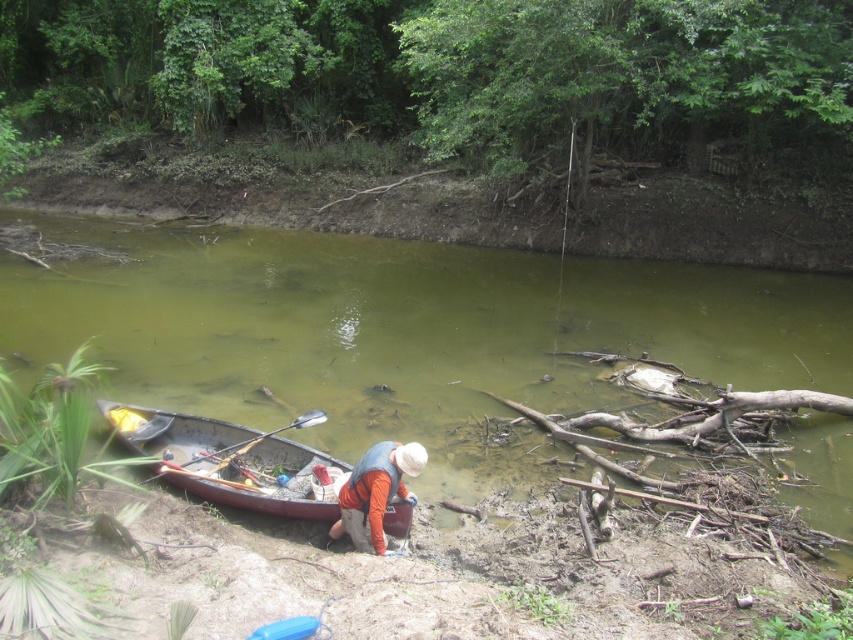
You are standing at the riverbank and see the orange fabric at lower center and the wooden polished paddle at lower center. Which object is taller?

The orange fabric at lower center is much taller than the wooden polished paddle at lower center.

You are standing at the edge of the river and see the green murky water at center and the orange fabric at lower center. Which object is closer to your right side?

The orange fabric at lower center is closer to your right side because the green murky water at center is to the left of it.

You are standing at the riverbank and want to pick up the orange fabric at lower center and the wooden polished paddle at lower center. Which object should you reach for first to grab the one closer to you?

The orange fabric at lower center is closer to the viewer than the wooden polished paddle at lower center, so you should reach for the orange fabric at lower center first.